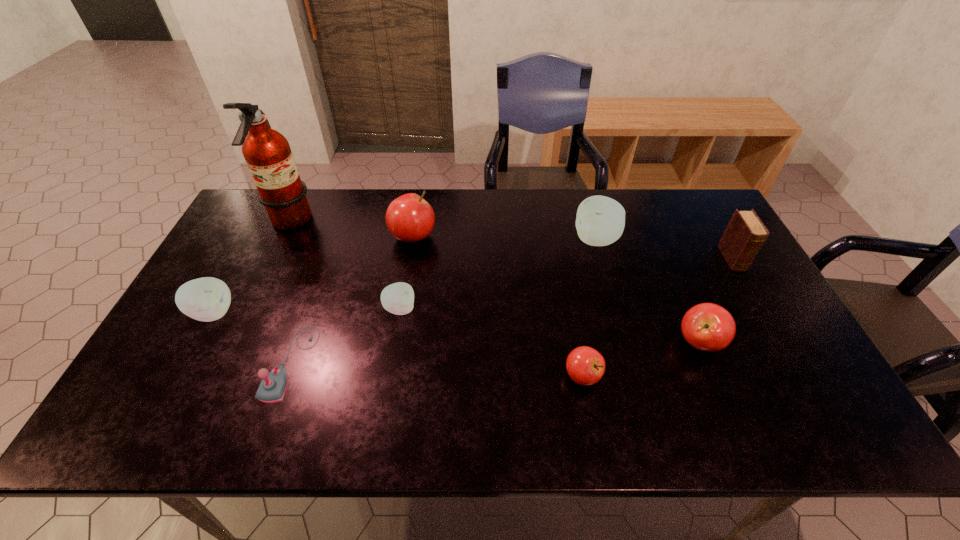
Find the location of a particular element. Image resolution: width=960 pixels, height=540 pixels. fire extinguisher is located at coordinates (267, 152).

This screenshot has height=540, width=960. Identify the location of the rightmost white apple. (600, 221).

This screenshot has height=540, width=960. I want to click on the farthest white apple, so click(600, 221).

Where is `the biggest red apple`? The width and height of the screenshot is (960, 540). the biggest red apple is located at coordinates (409, 218).

Identify the location of the farthest red apple. The image size is (960, 540). (409, 218).

The image size is (960, 540). Find the location of `diary`. diary is located at coordinates (745, 234).

I want to click on brown diary, so click(x=745, y=234).

What are the coordinates of `the leftmost white apple` in the screenshot? It's located at (207, 299).

Where is `the leftmost apple`? the leftmost apple is located at coordinates (207, 299).

This screenshot has height=540, width=960. I want to click on the rightmost red apple, so click(709, 327).